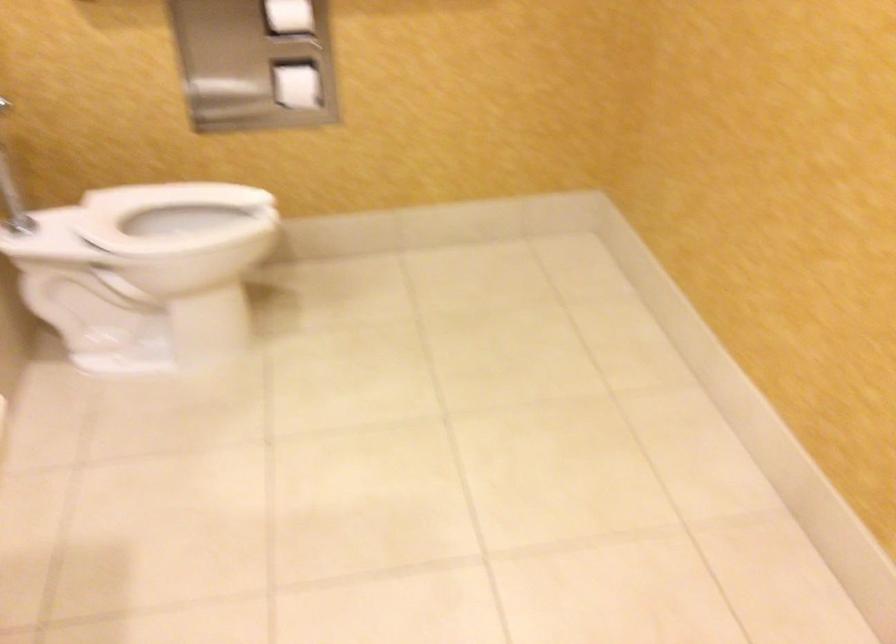
Describe the element at coordinates (12, 191) in the screenshot. I see `the toilet flush lever` at that location.